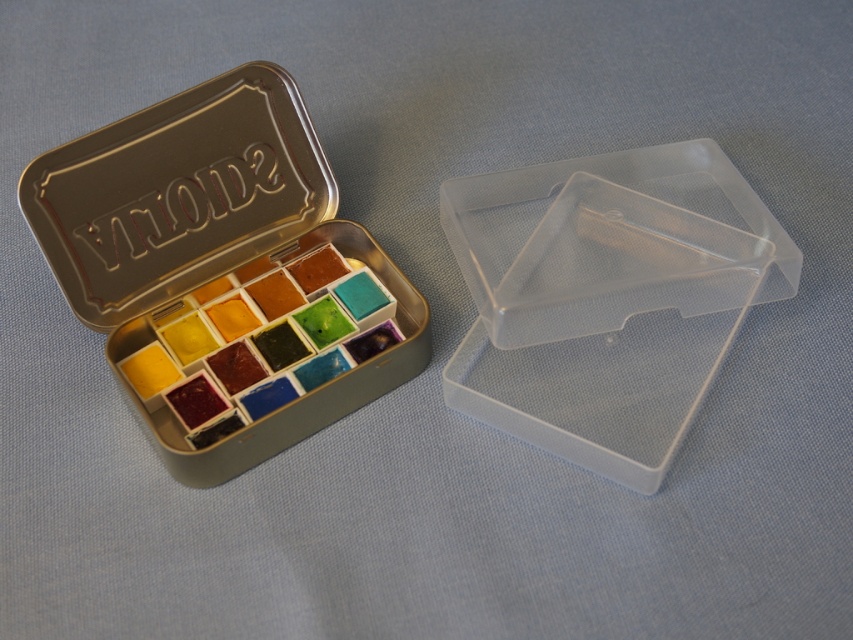
Question: Among these points, which one is farthest from the camera?

Choices:
 (A) (769, 275)
 (B) (177, 128)

Answer: (A)

Question: From the image, what is the correct spatial relationship of metallic tin at upper left in relation to transparent plastic box at center?

Choices:
 (A) right
 (B) left

Answer: (B)

Question: Considering the relative positions of metallic tin at upper left and transparent plastic box at center in the image provided, where is metallic tin at upper left located with respect to transparent plastic box at center?

Choices:
 (A) below
 (B) above

Answer: (B)

Question: Is metallic tin at upper left positioned before transparent plastic box at center?

Choices:
 (A) no
 (B) yes

Answer: (B)

Question: Which point is closer to the camera?

Choices:
 (A) metallic tin at upper left
 (B) transparent plastic box at center

Answer: (A)